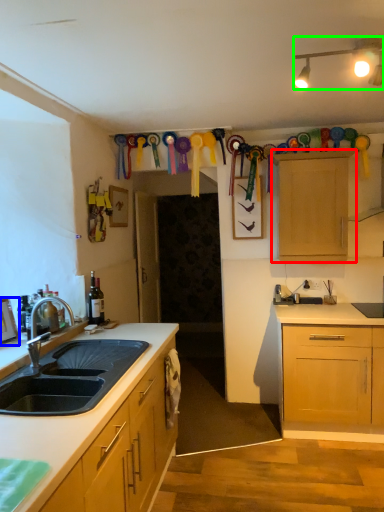
Question: Estimate the real-world distances between objects in this image. Which object is farther from cabinetry (highlighted by a red box), picture frame (highlighted by a blue box) or lamp (highlighted by a green box)?

Choices:
 (A) picture frame
 (B) lamp

Answer: (A)